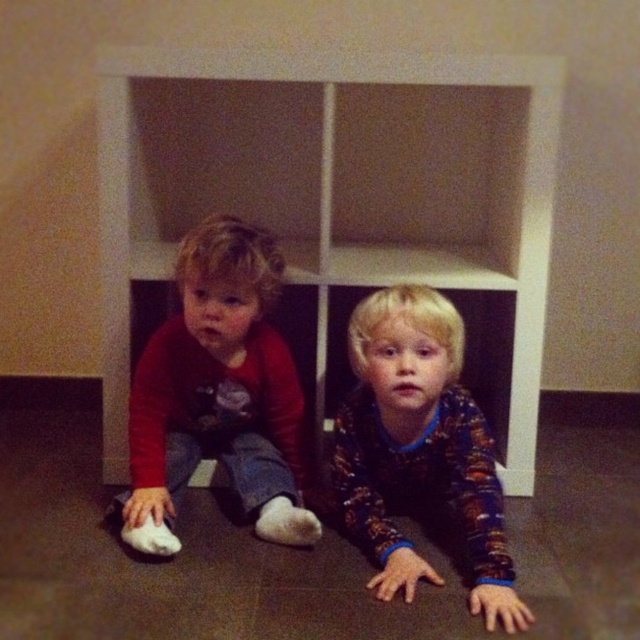
You are a delivery robot with a package that needs to be placed between the matte red shirt at left and the flannel pajamas at lower center. The package is 12 inches long. Will it fit in the space between them?

The distance between the matte red shirt at left and the flannel pajamas at lower center is 13.28 inches, which is longer than the 12 inch package. Therefore, the package will fit between them.

You are a photographer standing in front of the two children. You want to take a photo where both children are in focus. The camera can only focus on objects at a certain distance. Given that the point closer to you is at point (244, 321) and the other is further away at point (496, 541), will both children be in focus if you focus on the closer point?

Since point (244, 321) is closer to you than point (496, 541), focusing on the closer point may not ensure both children are in focus. The distance between them might exceed the camera focus range, so you might need to adjust focus or use a different technique.